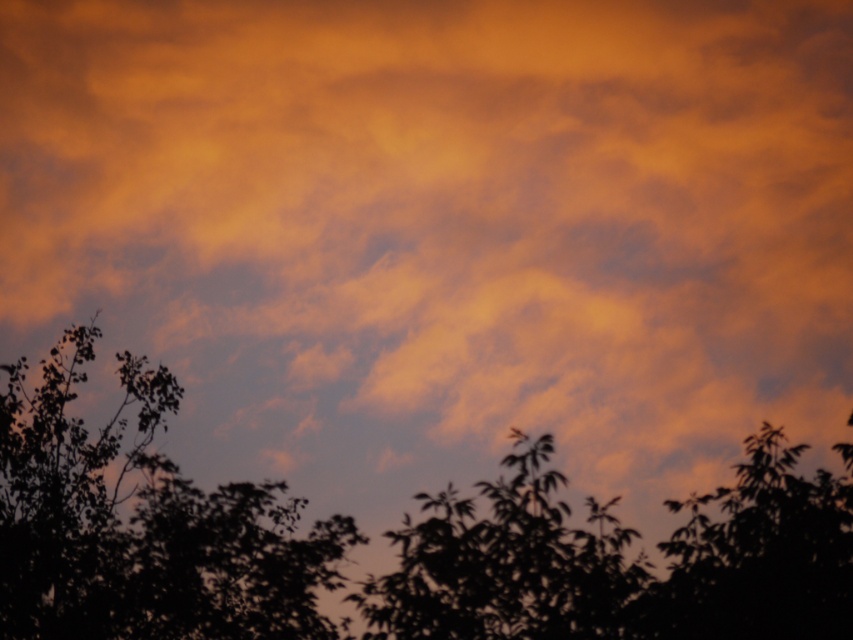
You are standing in a field looking at the silhouette leafy tree at lower center and the silhouette leafy tree at lower right. Which tree is closer to you?

The silhouette leafy tree at lower center is closer to you because it is in front of the silhouette leafy tree at lower right.

In the scene shown: You are an artist wanting to paint this scene. You have two trees in your viewfinder, the silhouette leafy tree at center and the silhouette leafy tree at lower right. Which tree should you sketch first if you want to capture the wider one first?

The silhouette leafy tree at center should be sketched first because its width surpasses that of the silhouette leafy tree at lower right.

In the scene shown: You are standing in a field and see the silhouette leafy tree at lower center. If you want to take a photo of the tree with the colorful sky in the background, where should you position yourself relative to the tree to ensure the sky is fully visible?

To capture the colorful sky in the background while photographing the silhouette leafy tree at lower center, position yourself behind the tree so the sky is behind it. Since the tree is at lower center, aligning yourself behind it will frame the vibrant sky above.